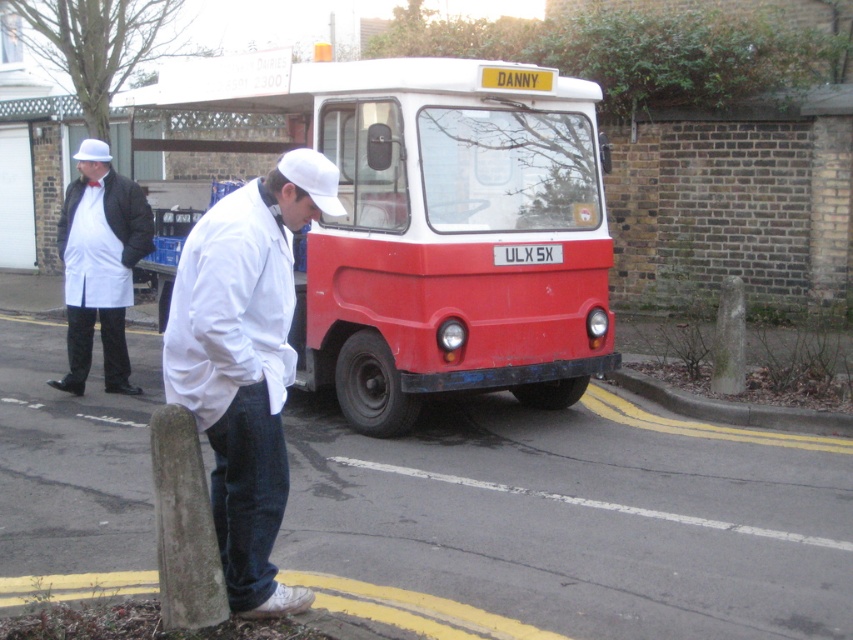
Question: Does white matte shirt at center appear on the right side of white matte coat at left?

Choices:
 (A) yes
 (B) no

Answer: (A)

Question: Does concrete at lower right have a lesser width compared to white plastic license plate at center?

Choices:
 (A) no
 (B) yes

Answer: (A)

Question: Which of these objects is positioned farthest from the white plastic license plate at center?

Choices:
 (A) white matte shirt at center
 (B) red matte food truck at center

Answer: (A)

Question: Which object is closer to the camera taking this photo?

Choices:
 (A) red matte food truck at center
 (B) concrete at lower right
 (C) white plastic license plate at center
 (D) white matte shirt at center

Answer: (D)

Question: Is red matte food truck at center below white matte coat at left?

Choices:
 (A) yes
 (B) no

Answer: (B)

Question: Which object is closer to the camera taking this photo?

Choices:
 (A) white plastic license plate at center
 (B) white matte coat at left
 (C) concrete at lower right

Answer: (A)